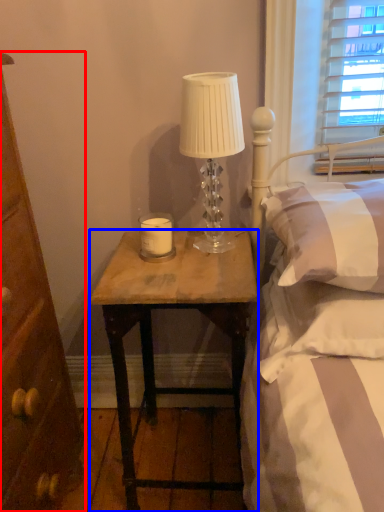
Question: Which object is further to the camera taking this photo, cabinetry (highlighted by a red box) or desk (highlighted by a blue box)?

Choices:
 (A) cabinetry
 (B) desk

Answer: (B)